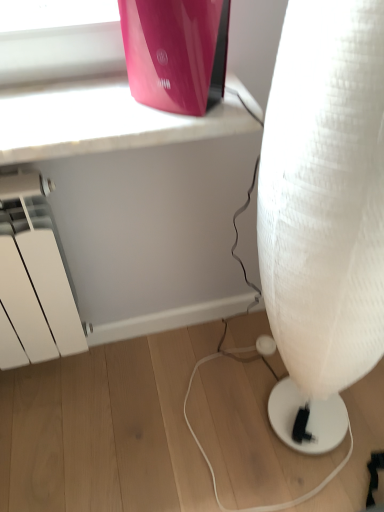
Question: Should I look upward or downward to see white fabric lamp at lower right?

Choices:
 (A) down
 (B) up

Answer: (A)

Question: Is white fabric lamp at lower right bigger than glossy plastic router at upper center?

Choices:
 (A) no
 (B) yes

Answer: (B)

Question: Considering the relative positions of white fabric lamp at lower right and glossy plastic router at upper center in the image provided, is white fabric lamp at lower right to the right of glossy plastic router at upper center from the viewer's perspective?

Choices:
 (A) no
 (B) yes

Answer: (B)

Question: Is white fabric lamp at lower right taller than glossy plastic router at upper center?

Choices:
 (A) no
 (B) yes

Answer: (B)

Question: Is white fabric lamp at lower right in front of glossy plastic router at upper center?

Choices:
 (A) yes
 (B) no

Answer: (A)

Question: Is white fabric lamp at lower right placed right next to glossy plastic router at upper center?

Choices:
 (A) yes
 (B) no

Answer: (B)

Question: From a real-world perspective, is white fabric lamp at lower right on glossy plastic router at upper center?

Choices:
 (A) no
 (B) yes

Answer: (A)

Question: Does glossy plastic router at upper center turn towards white fabric lamp at lower right?

Choices:
 (A) no
 (B) yes

Answer: (A)

Question: Considering the relative positions of glossy plastic router at upper center and white fabric lamp at lower right in the image provided, is glossy plastic router at upper center behind white fabric lamp at lower right?

Choices:
 (A) yes
 (B) no

Answer: (A)

Question: Is glossy plastic router at upper center not within white fabric lamp at lower right?

Choices:
 (A) no
 (B) yes

Answer: (B)

Question: Would you say white fabric lamp at lower right is part of glossy plastic router at upper center's contents?

Choices:
 (A) yes
 (B) no

Answer: (B)

Question: Can you confirm if glossy plastic router at upper center is bigger than white fabric lamp at lower right?

Choices:
 (A) no
 (B) yes

Answer: (A)

Question: From a real-world perspective, is glossy plastic router at upper center under white fabric lamp at lower right?

Choices:
 (A) yes
 (B) no

Answer: (B)

Question: Visually, is glossy plastic router at upper center positioned to the left or to the right of white fabric lamp at lower right?

Choices:
 (A) right
 (B) left

Answer: (B)